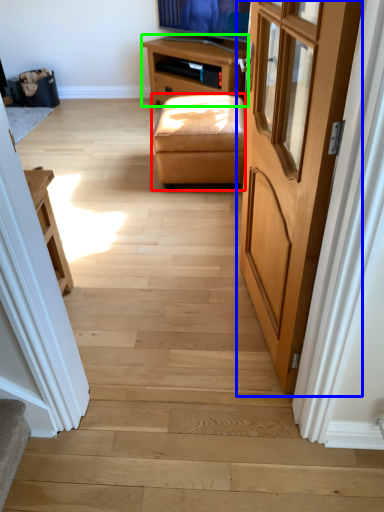
Question: Estimate the real-world distances between objects in this image. Which object is closer to stool (highlighted by a red box), door (highlighted by a blue box) or table (highlighted by a green box)?

Choices:
 (A) door
 (B) table

Answer: (B)